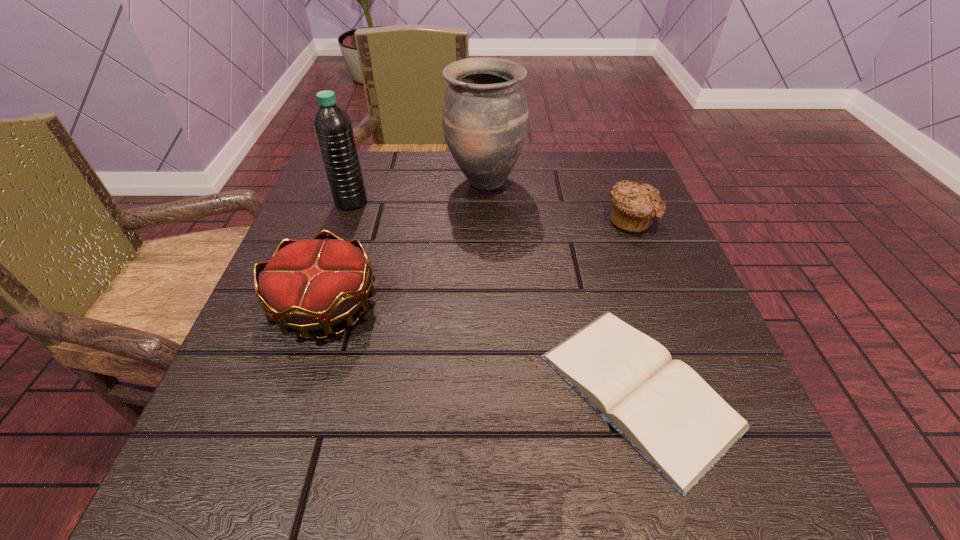
Identify the location of urn. (485, 114).

Identify the location of water bottle. (332, 125).

Where is `the third shortest object`? The image size is (960, 540). the third shortest object is located at coordinates (312, 284).

In order to click on the fourth tallest object in this screenshot , I will do `click(634, 206)`.

At what (x,y) coordinates should I click in order to perform the action: click on the shortest object. Please return your answer as a coordinate pair (x, y). Looking at the image, I should click on (661, 407).

At what (x,y) coordinates should I click in order to perform the action: click on vacant space located 0.210m on the right of the urn. Please return your answer as a coordinate pair (x, y). Looking at the image, I should click on (614, 181).

Find the location of `free space located 0.390m on the right of the water bottle`. free space located 0.390m on the right of the water bottle is located at coordinates (547, 202).

At what (x,y) coordinates should I click in order to perform the action: click on free space located on the back of the crown. Please return your answer as a coordinate pair (x, y). Looking at the image, I should click on (367, 179).

This screenshot has width=960, height=540. Identify the location of vacant space located 0.320m on the front of the fourth tallest object. (694, 379).

Find the location of a particular element. Image resolution: width=960 pixels, height=540 pixels. vacant point located on the left of the Bible is located at coordinates (461, 389).